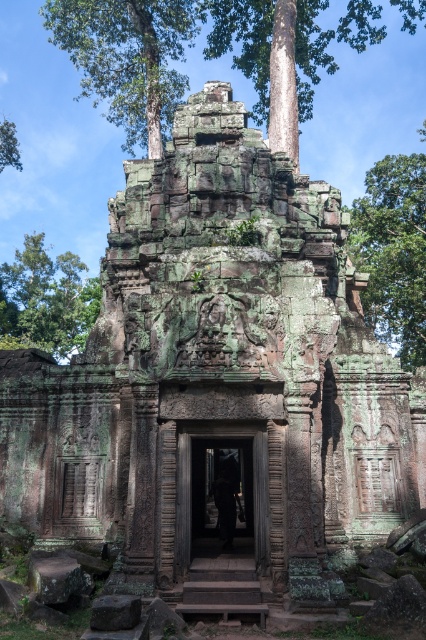
Who is taller, green mossy stone at upper center or green mossy tree at left?

green mossy stone at upper center

Does green mossy stone at upper center have a larger size compared to green mossy tree at left?

Indeed, green mossy stone at upper center has a larger size compared to green mossy tree at left.

This screenshot has height=640, width=426. Describe the element at coordinates (285, 52) in the screenshot. I see `green mossy stone at upper center` at that location.

Find the location of a particular element. The width and height of the screenshot is (426, 640). green mossy stone at upper center is located at coordinates (285, 52).

From the picture: Which is below, green textured stone at upper center or green mossy tree at upper left?

Positioned lower is green mossy tree at upper left.

Does green textured stone at upper center appear under green mossy tree at upper left?

Actually, green textured stone at upper center is above green mossy tree at upper left.

Who is more distant from viewer, (x=164, y=76) or (x=11, y=164)?

The point (x=11, y=164) is behind.

This screenshot has height=640, width=426. I want to click on green textured stone at upper center, so point(127,58).

Is green mossy tree at upper right taller than carved stone doorway at center?

Yes.

Who is more distant from viewer, (394,195) or (181,572)?

The point (394,195) is more distant.

Between point (423, 250) and point (184, 556), which one is positioned in front?

Point (184, 556)

Find the location of a particular element. green mossy tree at upper right is located at coordinates (394, 252).